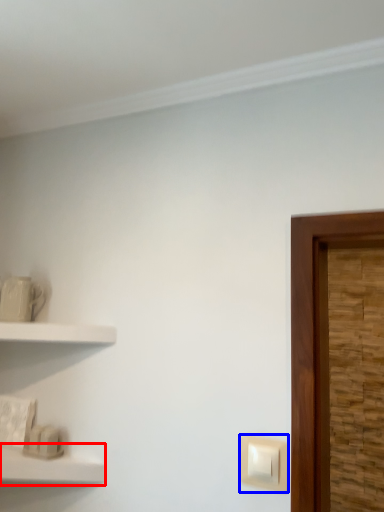
Question: Which object appears closest to the camera in this image, shelf (highlighted by a red box) or light switch (highlighted by a blue box)?

Choices:
 (A) shelf
 (B) light switch

Answer: (A)